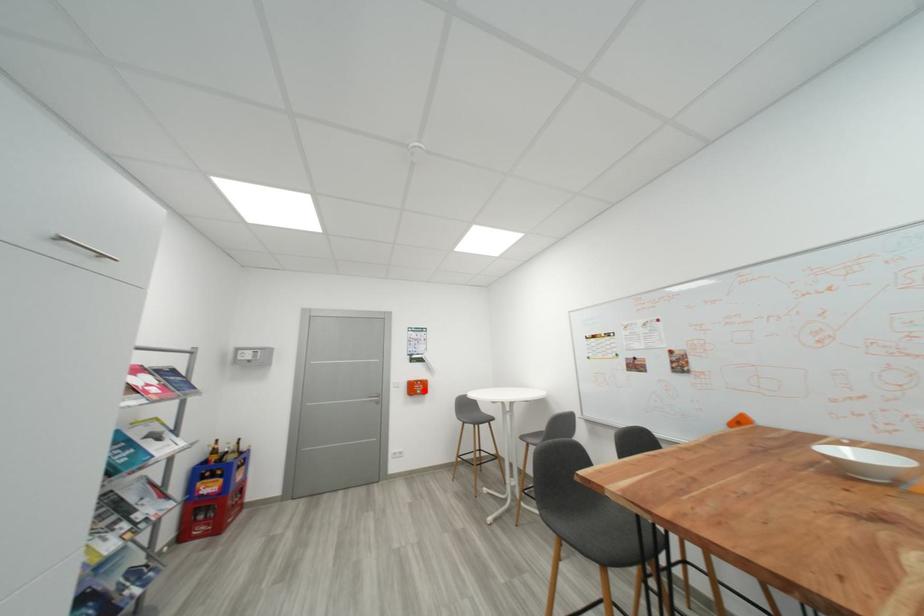
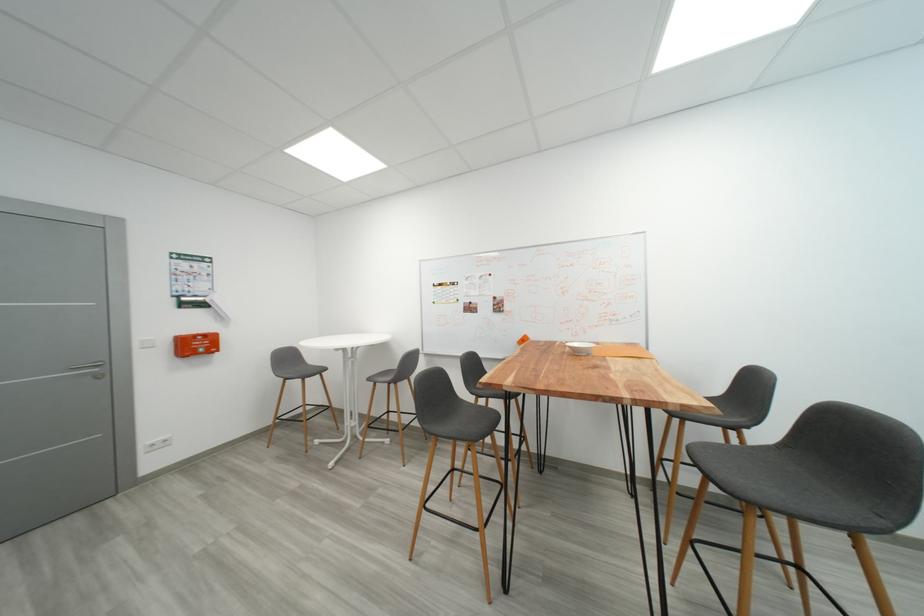
Find the pixel in the second image that matches the highlighted location in the first image.

(203, 347)